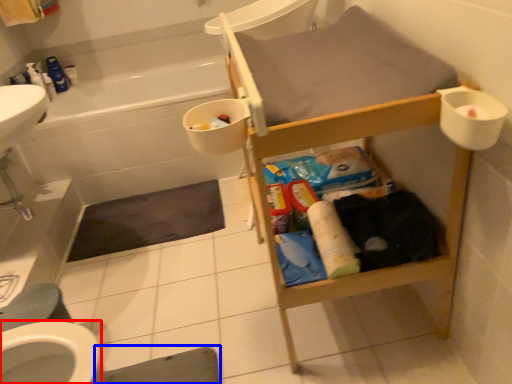
Question: Which of the following is the closest to the observer, bidet (highlighted by a red box) or bath mat (highlighted by a blue box)?

Choices:
 (A) bidet
 (B) bath mat

Answer: (B)